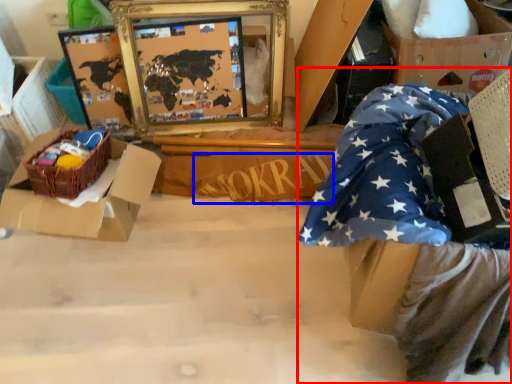
Question: Which point is closer to the camera, person (highlighted by a red box) or writing (highlighted by a blue box)?

Choices:
 (A) person
 (B) writing

Answer: (A)